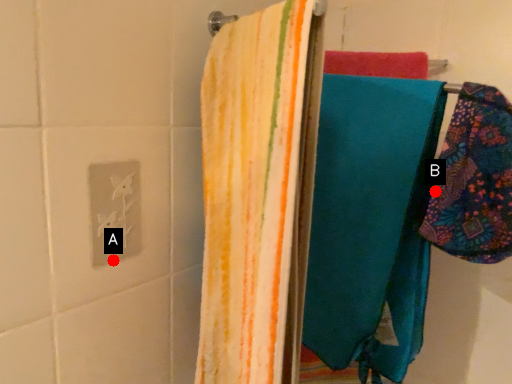
Question: Two points are circled on the image, labeled by A and B beside each circle. Among these points, which one is nearest to the camera?

Choices:
 (A) A is closer
 (B) B is closer

Answer: (B)